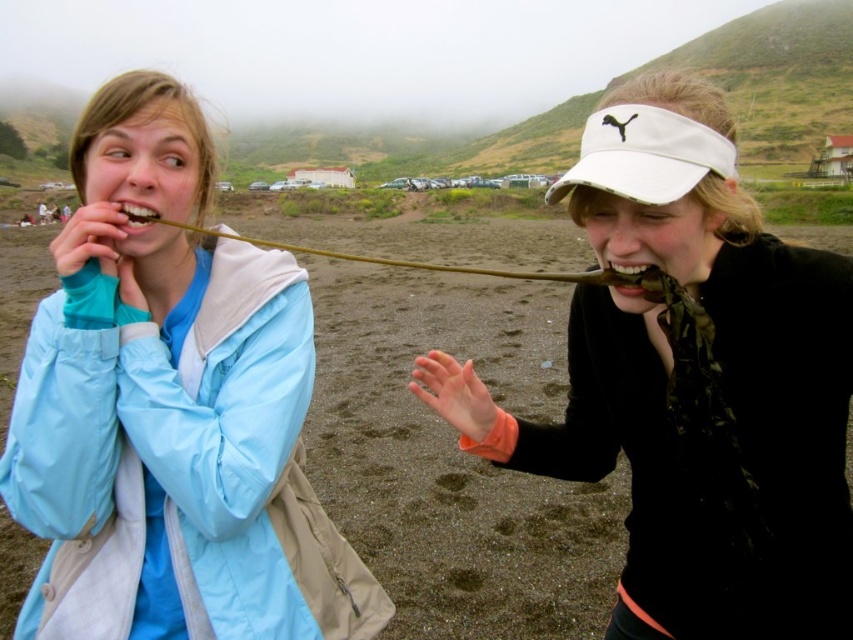
Question: Does matte blue jacket at left have a lesser width compared to white matte visor at center?

Choices:
 (A) yes
 (B) no

Answer: (A)

Question: Is matte blue jacket at left to the right of white matte visor at center from the viewer's perspective?

Choices:
 (A) no
 (B) yes

Answer: (A)

Question: Which object is farther from the camera taking this photo?

Choices:
 (A) white matte visor at center
 (B) matte blue jacket at left

Answer: (B)

Question: Where is matte blue jacket at left located in relation to white matte visor at center in the image?

Choices:
 (A) above
 (B) below

Answer: (A)

Question: Which point is farther from the camera taking this photo?

Choices:
 (A) click(x=262, y=492)
 (B) click(x=753, y=561)

Answer: (A)